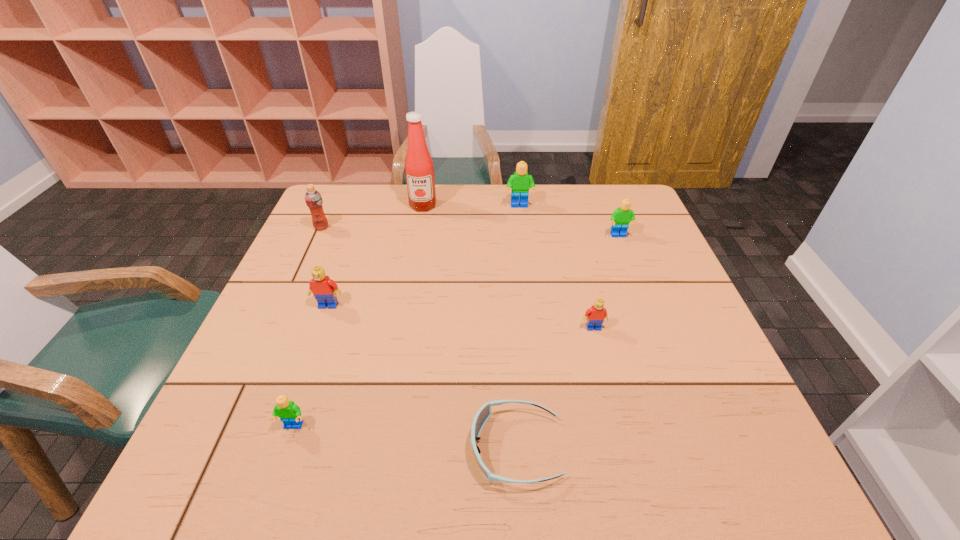
You are a GUI agent. You are given a task and a screenshot of the screen. Output one action in this format:
    pyautogui.click(x=<x>, y=<y>)
    Task: Click on the object present at the far left corner
    The height and width of the screenshot is (540, 960).
    Given the screenshot: What is the action you would take?
    pyautogui.click(x=313, y=199)

This screenshot has height=540, width=960. Identify the location of vacant area at the far edge of the desktop. (507, 215).

Identify the location of vacant area at the near edge of the desktop. (402, 470).

This screenshot has height=540, width=960. Identify the location of free space at the left edge. (324, 266).

Find the location of a particular element. free space at the right edge of the desktop is located at coordinates (677, 425).

In order to click on vacant space at the far left corner of the desktop in this screenshot , I will do `click(364, 188)`.

In the image, there is a desktop. At what (x,y) coordinates should I click in order to perform the action: click on vacant space at the far right corner. Please return your answer as a coordinate pair (x, y). The width and height of the screenshot is (960, 540). Looking at the image, I should click on (593, 214).

Identify the location of vacant area that lies between the third farthest object and the second farthest green Lego. pyautogui.click(x=470, y=232).

The height and width of the screenshot is (540, 960). What are the coordinates of `empty space between the biggest green Lego and the orange juice` in the screenshot? It's located at (420, 217).

At what (x,y) coordinates should I click in order to perform the action: click on empty space that is in between the leftmost object and the condiment. Please return your answer as a coordinate pair (x, y). Looking at the image, I should click on (372, 217).